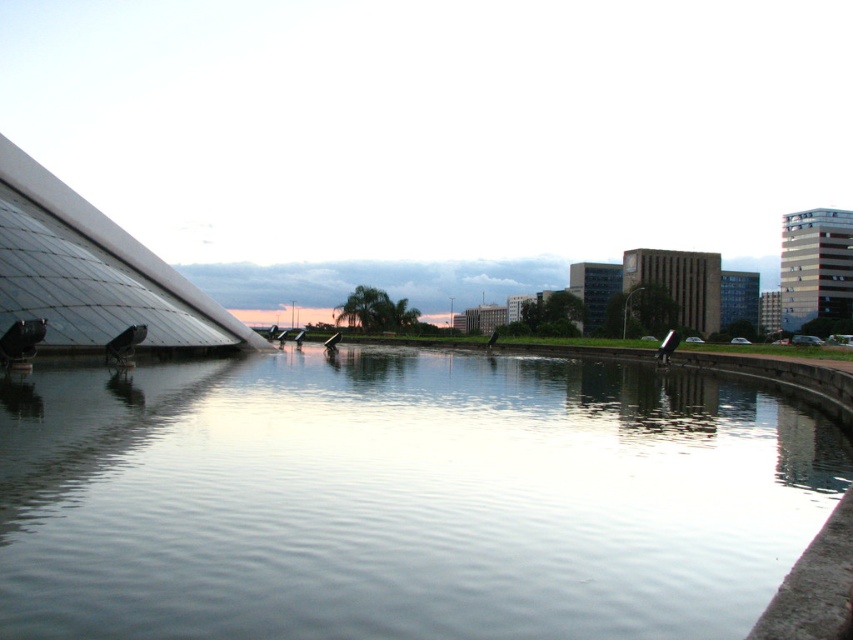
You are standing at the edge of the clear water at center and want to see the top of the transparent glass pyramid at upper left. Based on the scene, can you determine if the pyramid is taller than the water surface?

The clear water at center is shorter than the transparent glass pyramid at upper left, so yes, the transparent glass pyramid at upper left is taller than the water surface.

You are standing at the edge of the clear water at center and want to look at the transparent glass pyramid at upper left. Which direction should you turn your head to see it?

You should turn your head to the upper left to see the transparent glass pyramid at upper left, as it is located in that direction and is further away from the viewer compared to the clear water at center.